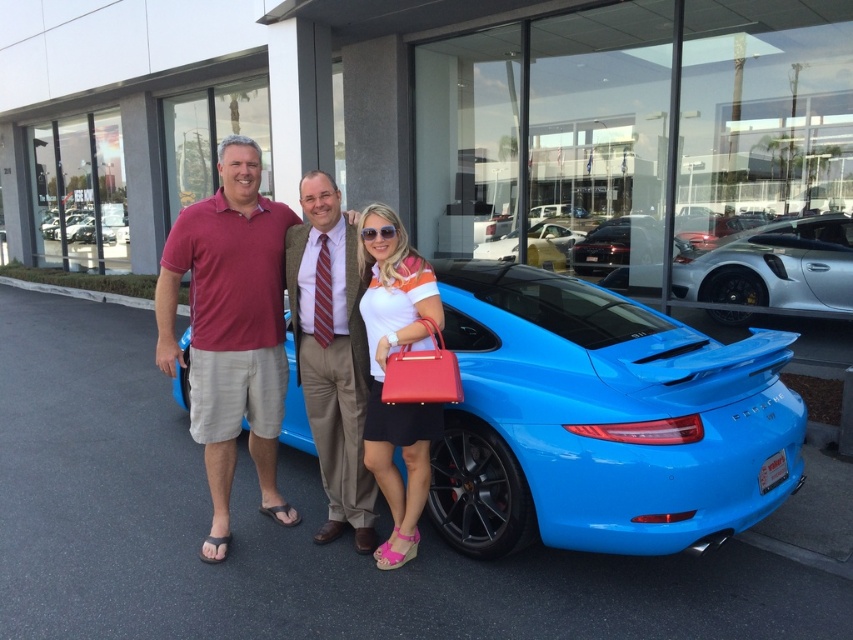
You are a car salesperson who needs to park two vehicles in a tight space. The shiny white car at center and the glossy blue sports car at center must be parked side by side. Given their sizes, which car should be placed closer to the curb to ensure both fit without overlapping?

The glossy blue sports car at center is smaller in size than the shiny white car at center. To fit both side by side, the glossy blue sports car at center should be placed closer to the curb since it takes up less space.

You are a photographer trying to capture a group photo of the matte orange shirt at center and the shiny white car at center. Based on their sizes, which one should you focus on to ensure both are clearly visible in the frame?

The matte orange shirt at center occupies less space than the shiny white car at center, so you should focus on the shiny white car at center to ensure both are clearly visible in the frame.